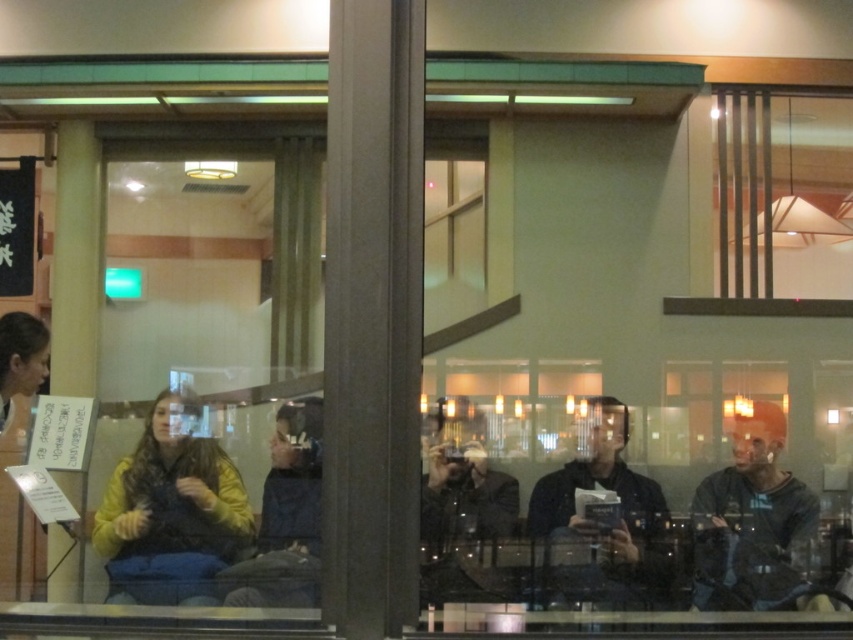
Question: Is yellow fleece sweater at lower left behind dark brown hair at left?

Choices:
 (A) yes
 (B) no

Answer: (B)

Question: Which point is closer to the camera?

Choices:
 (A) (152, 452)
 (B) (312, 486)

Answer: (A)

Question: Which point is closer to the camera?

Choices:
 (A) coord(767,444)
 (B) coord(624,435)

Answer: (B)

Question: Does dark gray sweater at right appear on the left side of dark brown hair at left?

Choices:
 (A) yes
 (B) no

Answer: (B)

Question: Is yellow fleece sweater at lower left further to camera compared to denim jacket at center?

Choices:
 (A) yes
 (B) no

Answer: (B)

Question: Among these objects, which one is nearest to the camera?

Choices:
 (A) denim jacket at center
 (B) yellow fleece sweater at lower left
 (C) dark brown hair at left
 (D) yellow fabric jacket at center

Answer: (D)